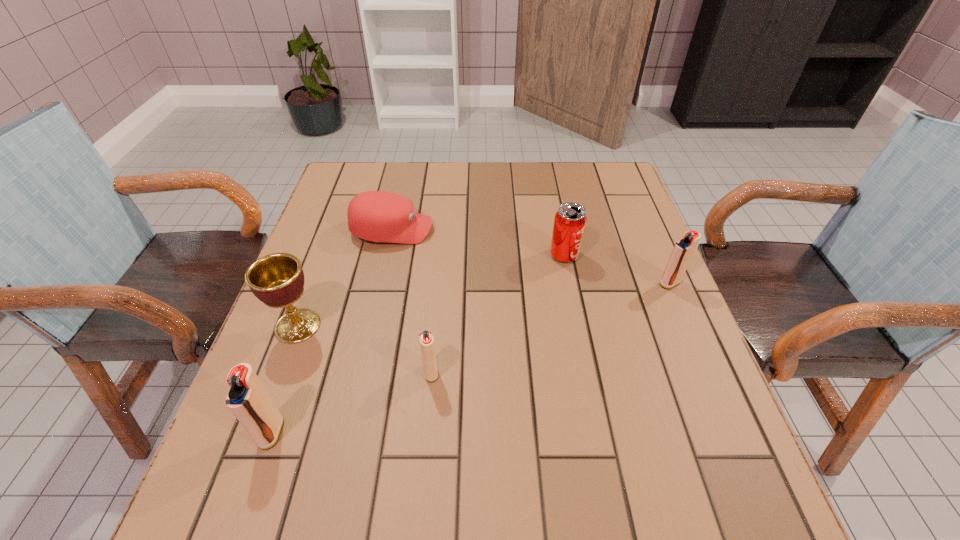
Image resolution: width=960 pixels, height=540 pixels. I want to click on the nearest igniter, so (248, 400).

Where is `the nearest object`? Image resolution: width=960 pixels, height=540 pixels. the nearest object is located at coordinates (248, 400).

This screenshot has width=960, height=540. In order to click on the second shortest object in this screenshot , I will do `click(426, 338)`.

You are a GUI agent. You are given a task and a screenshot of the screen. Output one action in this format:
    pyautogui.click(x=<x>, y=<y>)
    Task: Click on the fifth farthest object
    
    Given the screenshot: What is the action you would take?
    pyautogui.click(x=426, y=338)

At what (x,y) coordinates should I click in order to perform the action: click on the rightmost object. Please return your answer as a coordinate pair (x, y). The height and width of the screenshot is (540, 960). Looking at the image, I should click on (682, 253).

Identify the location of the fourth nearest object. The width and height of the screenshot is (960, 540). coord(682,253).

At what (x,y) coordinates should I click in order to perform the action: click on the shortest object. Please return your answer as a coordinate pair (x, y). Looking at the image, I should click on (377, 216).

Locate an element on the screen. chalice is located at coordinates (277, 280).

Locate an element on the screen. This screenshot has height=540, width=960. soda can is located at coordinates (570, 220).

Identify the location of vacant space located on the back of the nearest object. This screenshot has width=960, height=540. (309, 326).